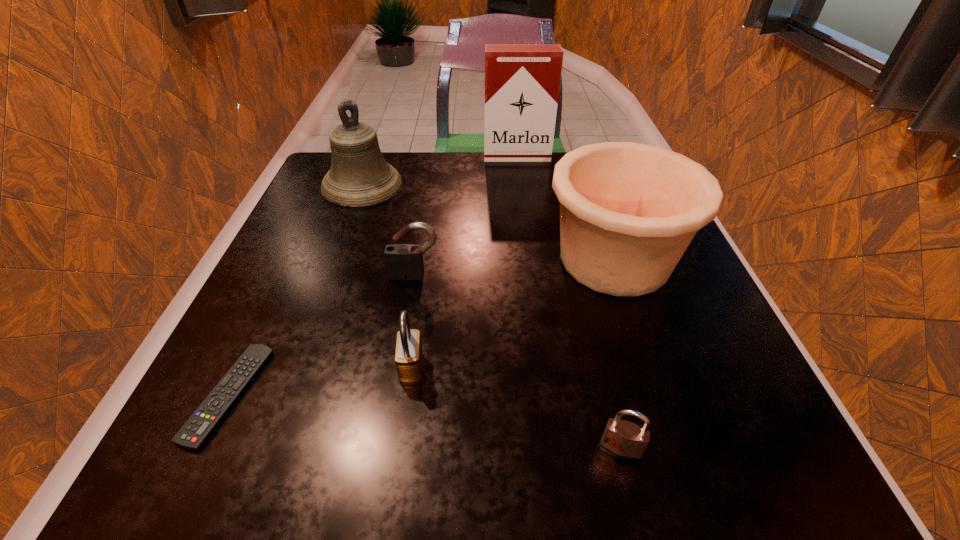
At what (x,y) coordinates should I click in order to perform the action: click on the second closest padlock relative to the nearest padlock. Please return your answer as a coordinate pair (x, y). Looking at the image, I should click on (402, 260).

Identify which padlock is the third nearest to the remote control. Please provide its 2D coordinates. Your answer should be formatted as a tuple, i.e. [(x, y)], where the tuple contains the x and y coordinates of a point satisfying the conditions above.

[(623, 440)]

Locate an element on the screen. This screenshot has height=540, width=960. free location that satisfies the following two spatial constraints: 1. on the front-facing side of the pottery; 2. on the left side of the cigarette_case is located at coordinates (530, 260).

I want to click on free location that satisfies the following two spatial constraints: 1. with the keyhole on the front of the second farthest padlock; 2. on the left side of the farthest padlock, so click(x=400, y=368).